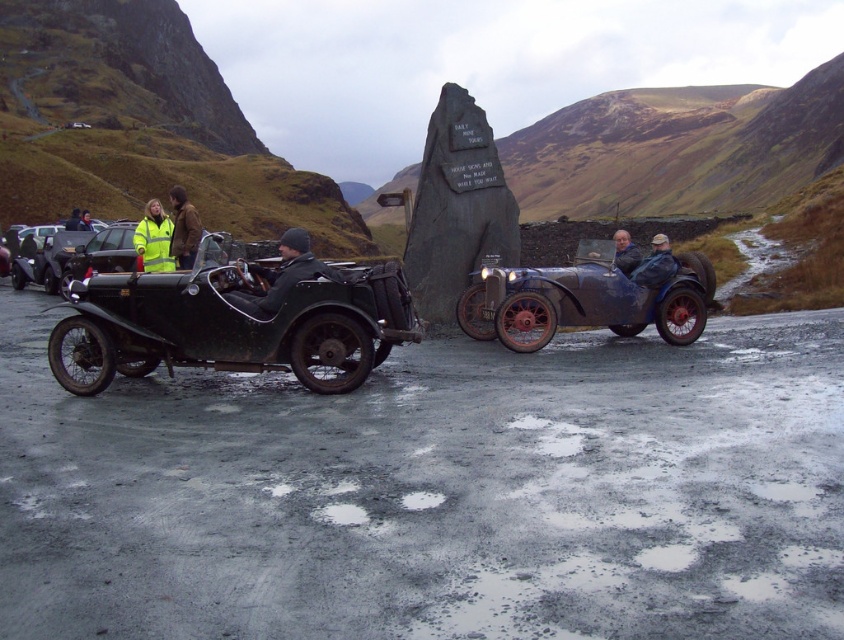
Can you confirm if dark green leather jacket at center is bigger than leather jacket at center?

Indeed, dark green leather jacket at center has a larger size compared to leather jacket at center.

Which is more to the left, dark green leather jacket at center or leather jacket at center?

dark green leather jacket at center is more to the left.

Does point (257, 307) come closer to viewer compared to point (647, 260)?

Yes.

The width and height of the screenshot is (844, 640). In order to click on dark green leather jacket at center in this screenshot , I will do `click(279, 276)`.

Can you confirm if dark gray stone monument at center is taller than reflective yellow jacket at left?

Incorrect, dark gray stone monument at center's height is not larger of reflective yellow jacket at left's.

Who is positioned more to the right, dark gray stone monument at center or reflective yellow jacket at left?

dark gray stone monument at center

Is point (487, 150) behind point (90, 225)?

That is False.

The image size is (844, 640). Identify the location of dark gray stone monument at center. (456, 208).

Does shiny black car at left appear on the left side of reflective yellow jacket at left?

Incorrect, shiny black car at left is not on the left side of reflective yellow jacket at left.

Identify the location of shiny black car at left. This screenshot has height=640, width=844. (44, 259).